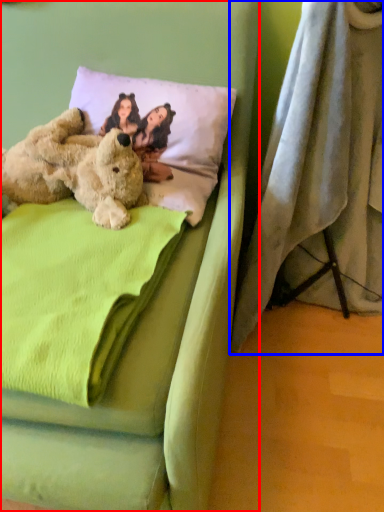
Question: Which object appears closest to the camera in this image, bed (highlighted by a red box) or curtain (highlighted by a blue box)?

Choices:
 (A) bed
 (B) curtain

Answer: (A)